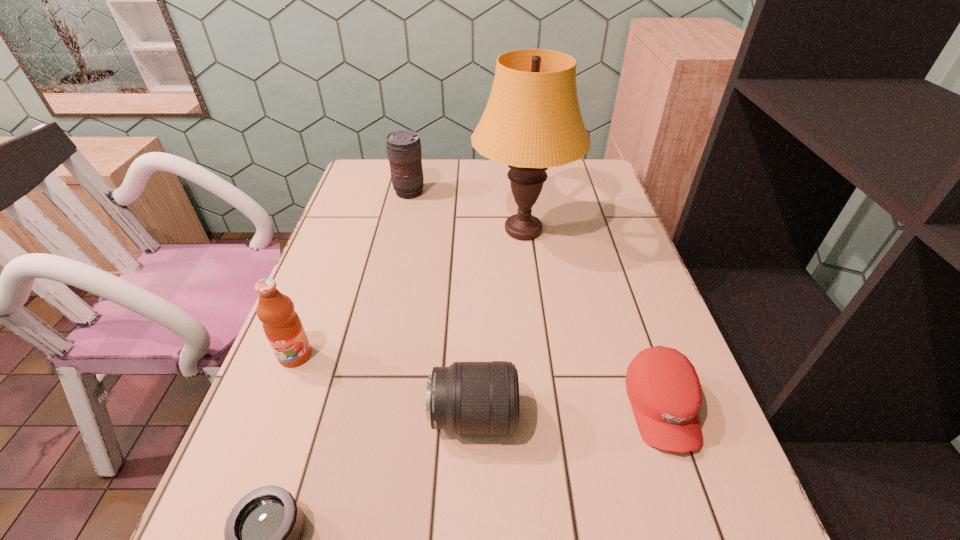
This screenshot has width=960, height=540. Identify the location of vacant space positioned on the front label of the fruit juice. (282, 389).

Identify the location of free region located 0.180m on the side of the farthest telephoto lens where the control switches are located. The image size is (960, 540). (399, 236).

Locate an element on the screen. free space located on the surface of the second nearest telephoto lens is located at coordinates (697, 417).

The width and height of the screenshot is (960, 540). Find the location of `vacant space located 0.070m on the front-facing side of the fifth tallest object`. vacant space located 0.070m on the front-facing side of the fifth tallest object is located at coordinates tap(693, 501).

Find the location of a particular element. The image size is (960, 540). object present at the far edge is located at coordinates (404, 152).

Image resolution: width=960 pixels, height=540 pixels. In order to click on fruit juice situated at the left edge in this screenshot , I will do `click(282, 326)`.

This screenshot has width=960, height=540. What are the coordinates of `telephoto lens that is at the left edge` in the screenshot? It's located at (404, 152).

At what (x,y) coordinates should I click in order to perform the action: click on lampshade at the right edge. Please return your answer as a coordinate pair (x, y). The width and height of the screenshot is (960, 540). Looking at the image, I should click on (532, 121).

Where is `cap present at the right edge`? Image resolution: width=960 pixels, height=540 pixels. cap present at the right edge is located at coordinates (663, 387).

You are a GUI agent. You are given a task and a screenshot of the screen. Output one action in this format:
    pyautogui.click(x=<x>, y=<y>)
    Task: Click on the object that is positioned at the far left corner
    Image resolution: width=960 pixels, height=540 pixels.
    Given the screenshot: What is the action you would take?
    pyautogui.click(x=404, y=152)